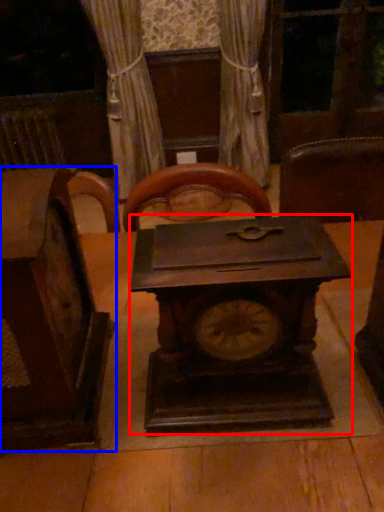
Question: Which object is further to the camera taking this photo, clock (highlighted by a red box) or furniture (highlighted by a blue box)?

Choices:
 (A) clock
 (B) furniture

Answer: (A)